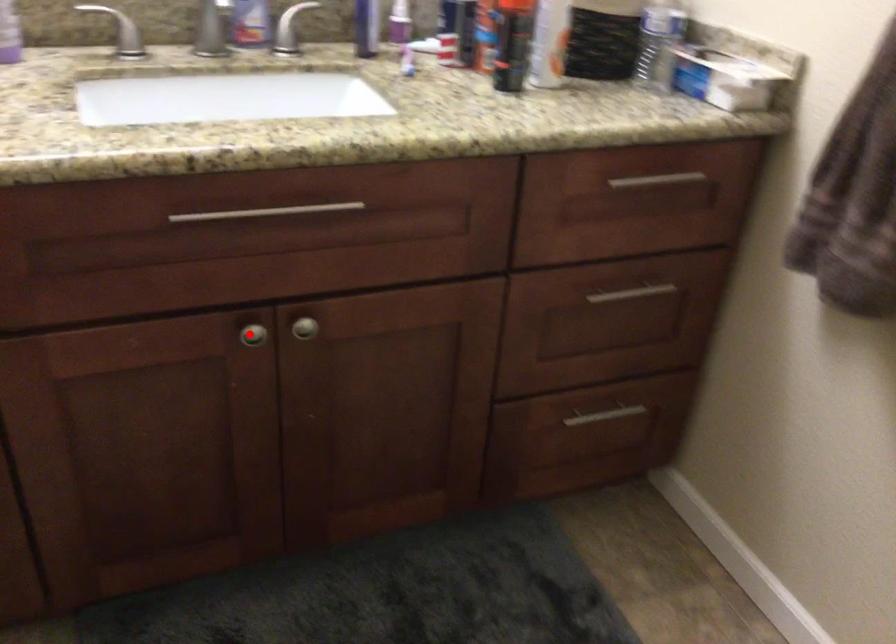
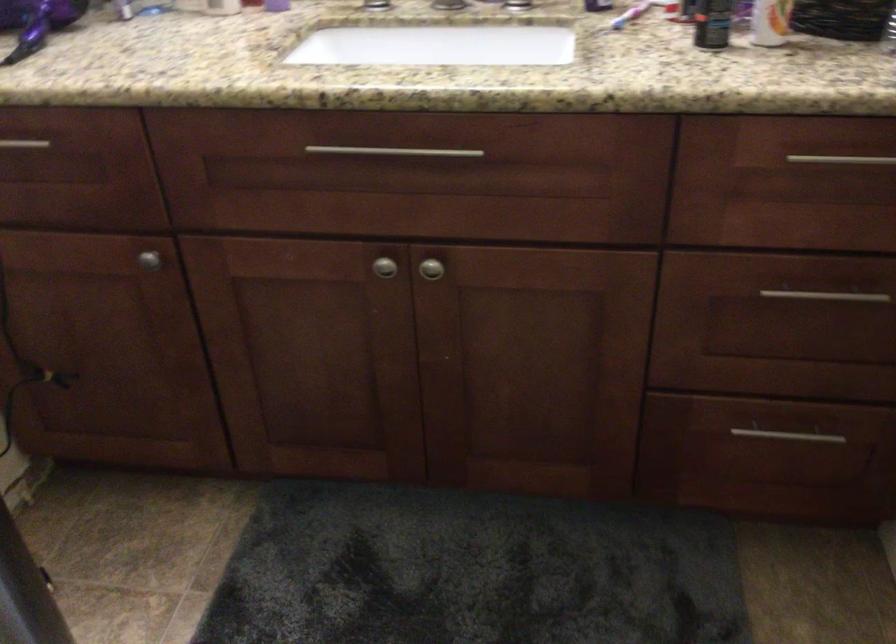
Find the pixel in the second image that matches the highlighted location in the first image.

(383, 267)